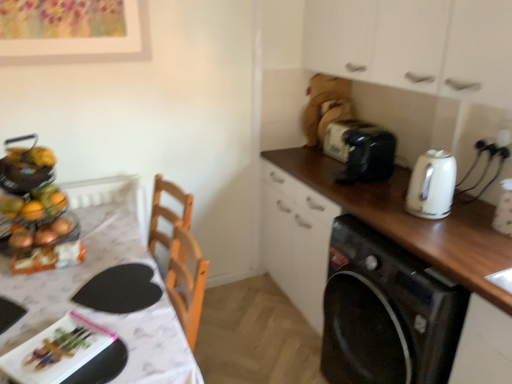
Question: Can black glossy washing machine at right be found inside black plastic toaster at upper right?

Choices:
 (A) no
 (B) yes

Answer: (A)

Question: From a real-world perspective, is black plastic toaster at upper right beneath black glossy washing machine at right?

Choices:
 (A) no
 (B) yes

Answer: (A)

Question: From the image's perspective, would you say black plastic toaster at upper right is shown under black glossy washing machine at right?

Choices:
 (A) yes
 (B) no

Answer: (B)

Question: Considering the relative sizes of black plastic toaster at upper right and black glossy washing machine at right in the image provided, is black plastic toaster at upper right bigger than black glossy washing machine at right?

Choices:
 (A) no
 (B) yes

Answer: (A)

Question: Does black plastic toaster at upper right have a greater height compared to black glossy washing machine at right?

Choices:
 (A) no
 (B) yes

Answer: (A)

Question: Is black plastic toaster at upper right smaller than black glossy washing machine at right?

Choices:
 (A) yes
 (B) no

Answer: (A)

Question: From a real-world perspective, is white glossy table at left on black plastic toaster at upper right?

Choices:
 (A) yes
 (B) no

Answer: (B)

Question: Is white glossy table at left closer to the viewer compared to black plastic toaster at upper right?

Choices:
 (A) yes
 (B) no

Answer: (A)

Question: Is black plastic toaster at upper right at the back of white glossy table at left?

Choices:
 (A) no
 (B) yes

Answer: (A)

Question: From a real-world perspective, is white glossy table at left physically below black plastic toaster at upper right?

Choices:
 (A) yes
 (B) no

Answer: (A)

Question: Is white glossy table at left far away from black plastic toaster at upper right?

Choices:
 (A) no
 (B) yes

Answer: (B)

Question: Considering the relative sizes of white glossy table at left and black plastic toaster at upper right in the image provided, is white glossy table at left thinner than black plastic toaster at upper right?

Choices:
 (A) no
 (B) yes

Answer: (A)

Question: Could white glossy table at left be considered to be inside white matte cabinet at upper right?

Choices:
 (A) yes
 (B) no

Answer: (B)